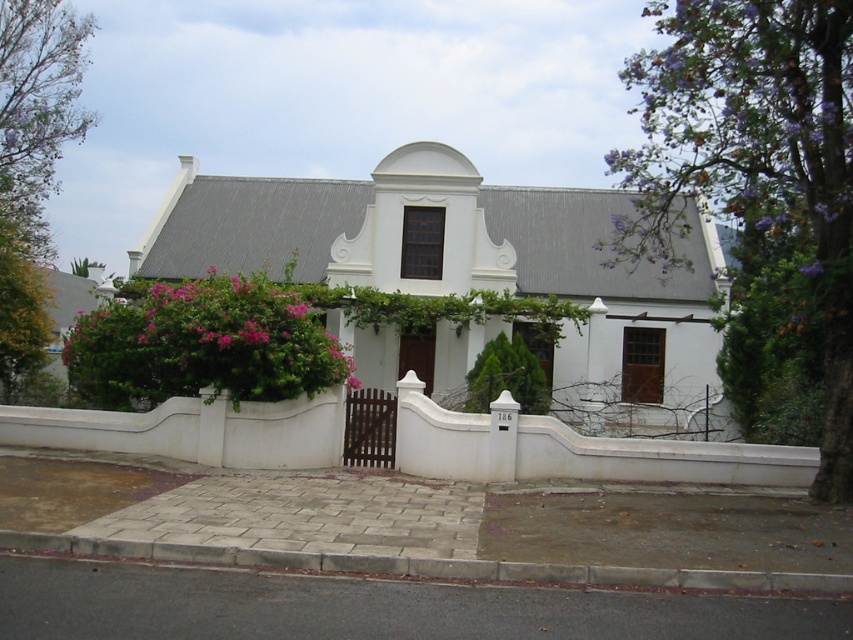
Find the location of a particular element. This screenshot has width=853, height=640. pink matte flowers at center is located at coordinates (202, 346).

Does point (103, 394) come behind point (56, 72)?

That is False.

Which is behind, point (312, 385) or point (32, 316)?

Positioned behind is point (32, 316).

What are the coordinates of `pink matte flowers at center` in the screenshot? It's located at (202, 346).

Between white smooth house at center and green leafy tree at left, which one is positioned lower?

white smooth house at center is lower down.

From the picture: Who is positioned more to the left, white smooth house at center or green leafy tree at left?

From the viewer's perspective, green leafy tree at left appears more on the left side.

Does point (721, 438) lie in front of point (15, 353)?

No, it is behind (15, 353).

This screenshot has width=853, height=640. Identify the location of white smooth house at center. (471, 269).

Which of these two, purple leafy tree at upper right or pink matte flowers at center, stands taller?

Standing taller between the two is purple leafy tree at upper right.

Does point (834, 262) come in front of point (102, 364)?

That is True.

Is point (714, 179) farther from viewer compared to point (190, 365)?

Yes, it is behind point (190, 365).

You are a GUI agent. You are given a task and a screenshot of the screen. Output one action in this format:
    pyautogui.click(x=<x>, y=<y>)
    Task: Click on the purple leafy tree at upper right
    This screenshot has width=853, height=640.
    Given the screenshot: What is the action you would take?
    pyautogui.click(x=753, y=157)